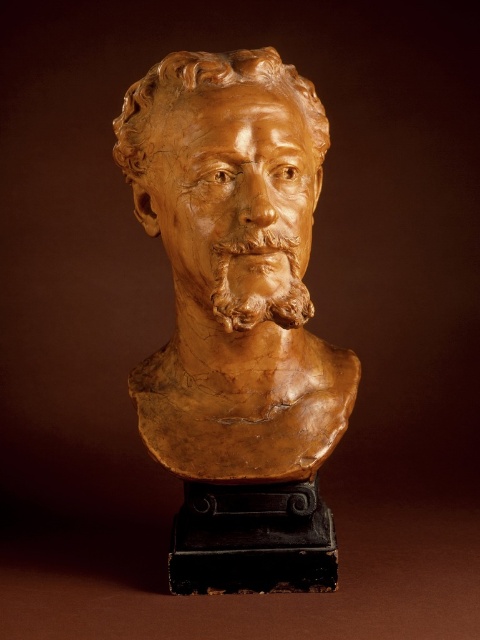
You are an art conservator examining the sculpture. You notice a small crack at point (238, 317). Where exactly is this crack located on the sculpture?

The crack at point (238, 317) is located at the matte clay bust at center.

You are an art curator arranging a display. You have two sculptures in front of you, the matte clay bust at center and the brown clay bust at center. According to their positions, which one is located to the right?

The matte clay bust at center is located to the right of the brown clay bust at center.